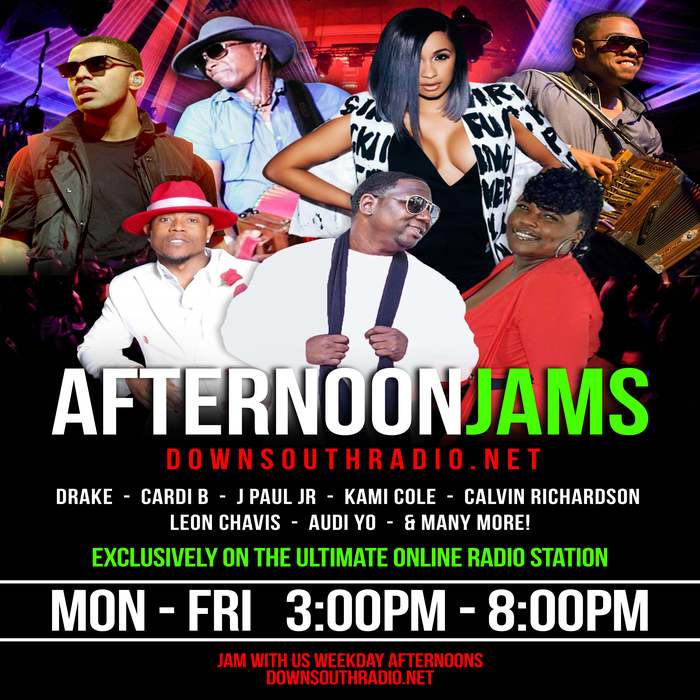
Locate an element on the screen. This screenshot has width=700, height=700. red lights is located at coordinates (348, 21).